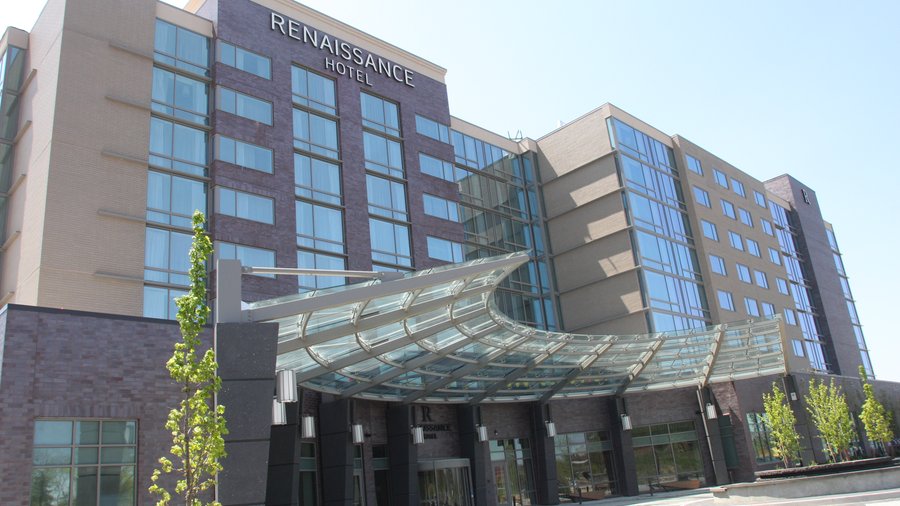
This screenshot has height=506, width=900. Find the location of `lights`. lights is located at coordinates (316, 431), (352, 435), (421, 437), (491, 439), (550, 435), (631, 430), (712, 423).